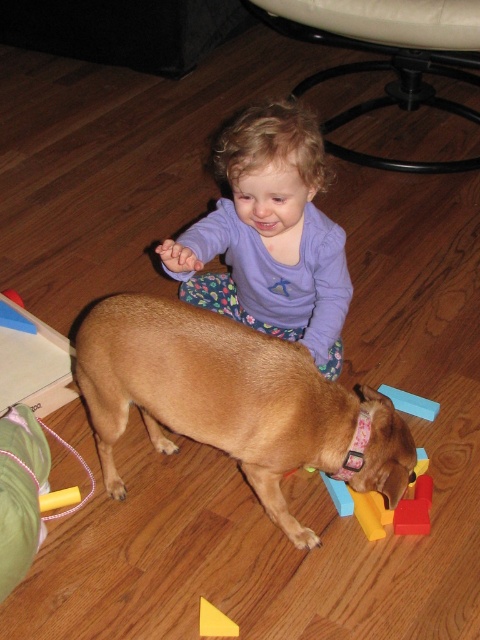
You are a parent trying to decide which item to pick up first between the golden brown fur at center and the purple soft shirt at center. Based on their sizes, which one is easier to grab quickly?

The golden brown fur at center has a smaller size compared to purple soft shirt at center, so it is easier to grab quickly.

You are a photographer trying to capture the perfect shot of the purple soft shirt at center. If your camera has a focus point at coordinates 0.369, 0.562, will it align with the shirt?

Yes, the purple soft shirt at center is exactly at point (269, 236), so the camera focus point will align with it.